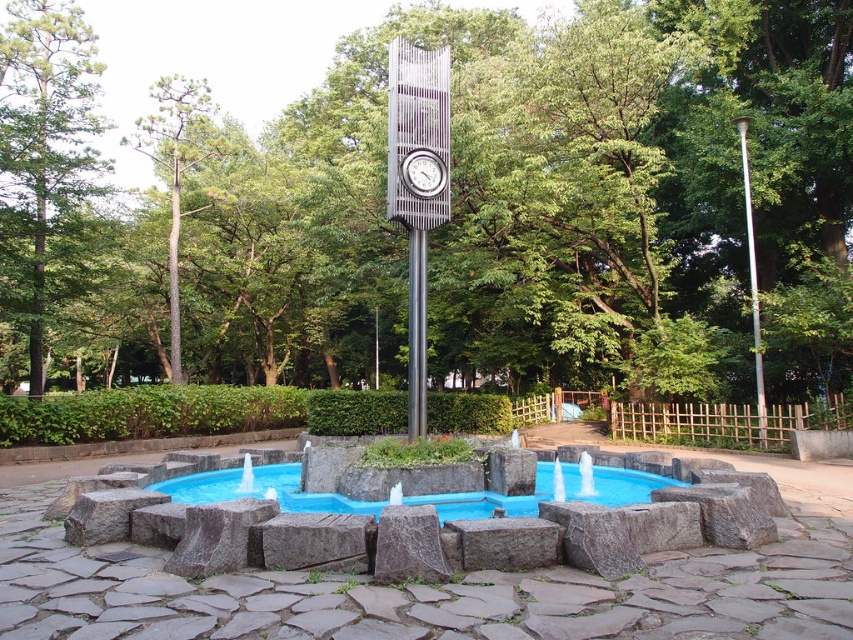
Question: Is the position of blue granite pool at center more distant than that of silver metallic pole at upper right?

Choices:
 (A) no
 (B) yes

Answer: (A)

Question: Which is nearer to the silver metallic pole at upper right?

Choices:
 (A) metallic pole at center
 (B) blue granite pool at center
 (C) metallic clock at center

Answer: (A)

Question: Observing the image, what is the correct spatial positioning of green leafy tree at left in reference to green rough bark tree at left?

Choices:
 (A) below
 (B) above

Answer: (A)

Question: Which object is positioned closest to the green leafy tree at center?

Choices:
 (A) blue granite pool at center
 (B) green leafy tree at left
 (C) metallic clock at center

Answer: (B)

Question: Does green leafy tree at left have a lesser width compared to blue granite pool at center?

Choices:
 (A) yes
 (B) no

Answer: (B)

Question: Which object appears closest to the camera in this image?

Choices:
 (A) metallic pole at center
 (B) metallic clock at center
 (C) green leafy tree at left
 (D) silver metallic pole at upper right

Answer: (A)